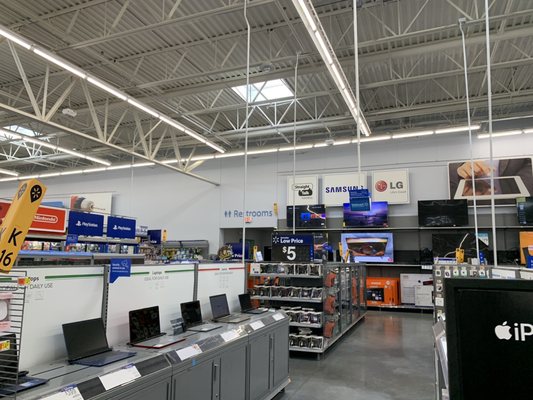
Find the location of a particular element. The width and height of the screenshot is (533, 400). laptop is located at coordinates (88, 335).